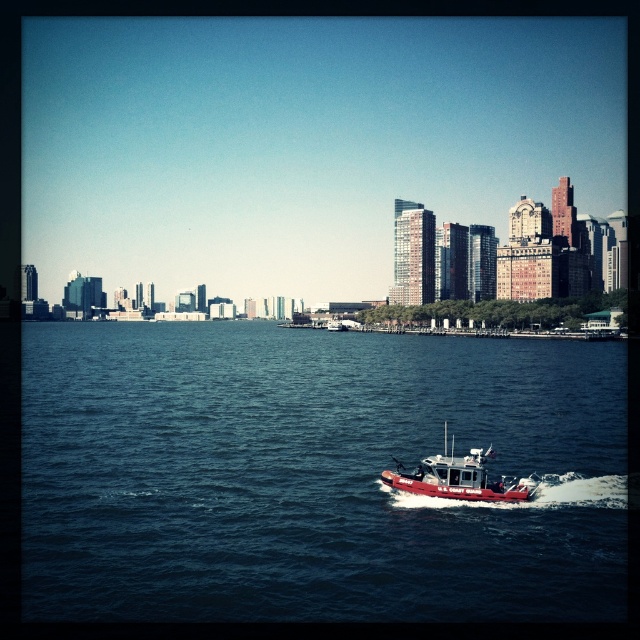
You are a drone operator flying a drone over the waterfront scene. Your drone is currently at the point marked by point [314,476]. What is directly below your drone?

The point marked by point [314,476] is directly above the blue water at center, so the drone is hovering above the blue water at center.

You are a photographer standing on the dock and want to capture both the blue water at center and the red matte boat at center in the same frame. Based on their positions, which object should you adjust your camera to focus on first to ensure both are in the shot?

You should focus on the blue water at center first since it is positioned to the left of the red matte boat at center, allowing you to frame both objects by adjusting the camera to include both their left and right positions.